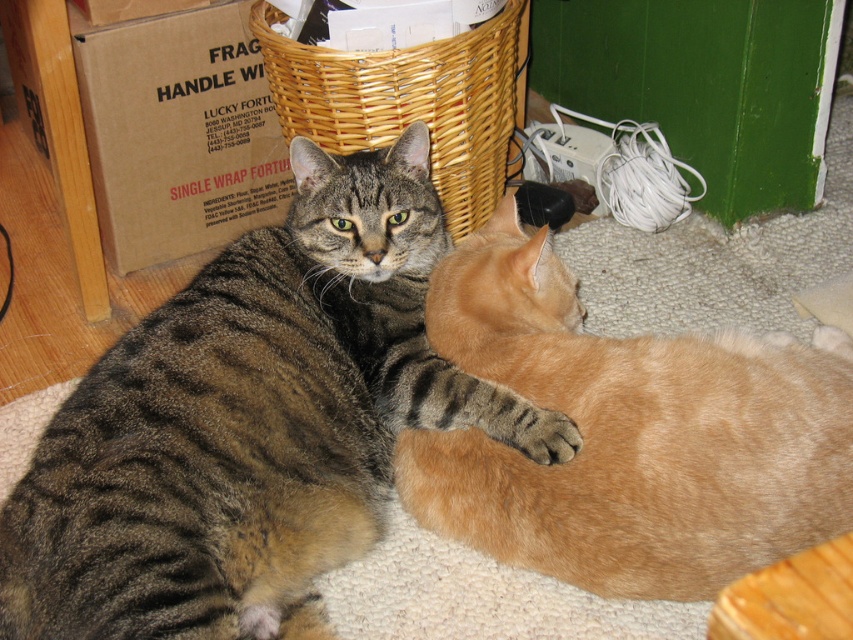
From the picture: You are standing in the room where the two cats are resting. You want to place a small toy between the two points, point 1 at (402, 202) and point 2 at (486, 108). Which point should the toy be closer to so that it is in front of the other point?

The toy should be closer to point 1 at (402, 202) because it is in front of point 2 at (486, 108).

You are a cat owner trying to decide where to place a new scratching post. You see the brown cardboard box at upper left and the soft fur paw at lower center. Which object is positioned higher up in the image?

The brown cardboard box at upper left is positioned higher up in the image than the soft fur paw at lower center.

You are a cat owner who wants to place a small toy between the orange fur cat at center and the brown cardboard box at upper left. Which object is taller so you can decide where to place the toy?

The orange fur cat at center is taller than the brown cardboard box at upper left, so you should place the toy near the orange fur cat at center to ensure it is visible over the brown cardboard box at upper left.